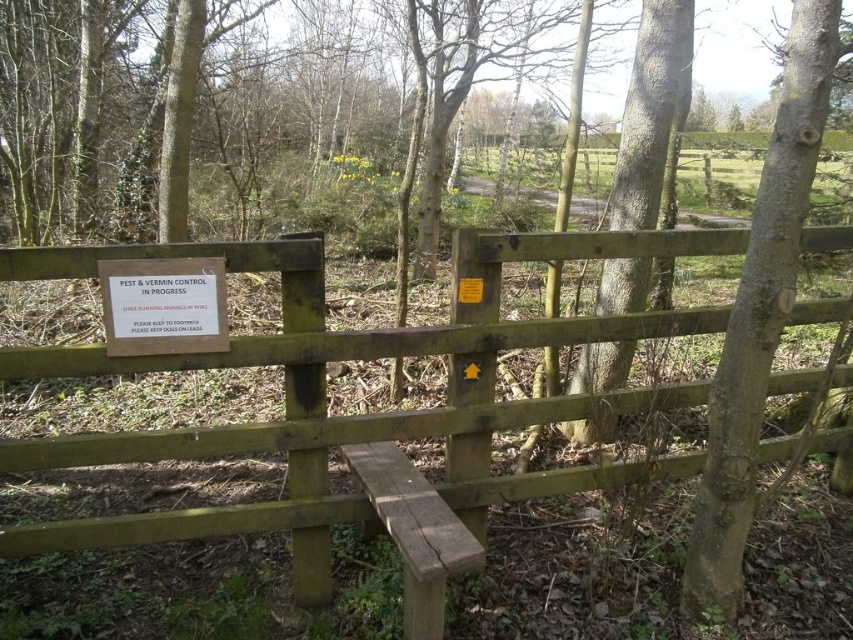
You are a hiker who wants to take a photo of the green wooden fence at center and the rough bark tree at center. Which object should you focus on first if you want both to be in focus without moving the camera?

The green wooden fence at center is larger in size than the rough bark tree at center, so focusing on the larger object first will ensure both are in focus.

You are standing at the point with coordinates of origin. You want to walk to the rough bark tree at center. In which direction should you walk?

The rough bark tree at center is located at coordinates point [759,312]. Since the origin is at [0,0], you should walk in the positive x and positive y direction to reach it.